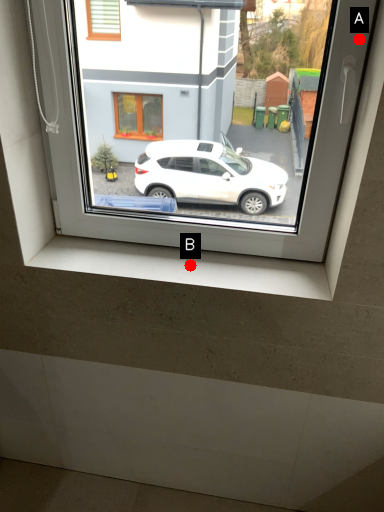
Question: Two points are circled on the image, labeled by A and B beside each circle. Which of the following is the farthest from the observer?

Choices:
 (A) A is further
 (B) B is further

Answer: (B)